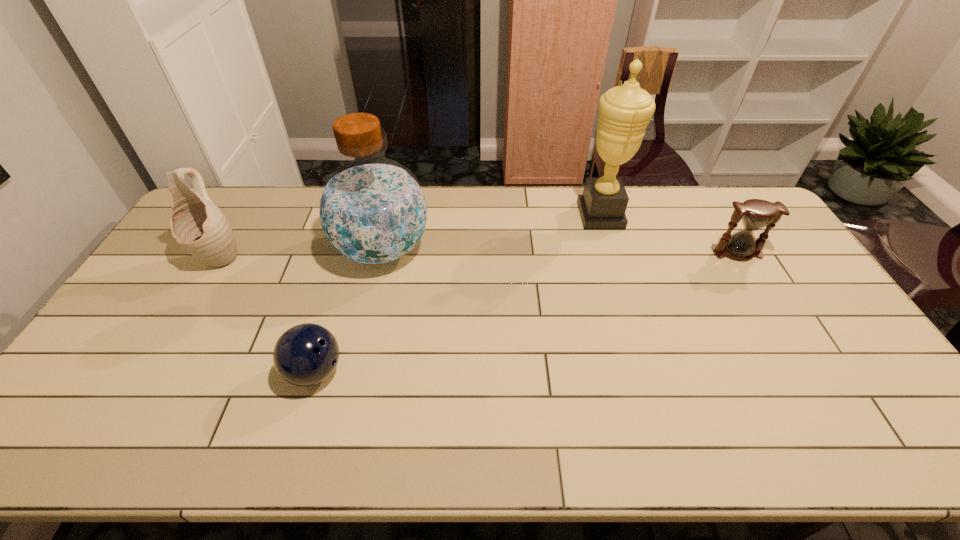
Image resolution: width=960 pixels, height=540 pixels. I want to click on trophy cup, so click(625, 111).

Locate an element on the screen. The width and height of the screenshot is (960, 540). the fourth object from left to right is located at coordinates (625, 111).

This screenshot has height=540, width=960. Find the location of `water jug`. water jug is located at coordinates (372, 211).

Where is `the leftmost object`? the leftmost object is located at coordinates (197, 224).

Identify the location of the third tallest object. (197, 224).

The width and height of the screenshot is (960, 540). What are the coordinates of `the rightmost object` in the screenshot? It's located at (755, 214).

Identify the location of hourglass. This screenshot has height=540, width=960. (755, 214).

Find the location of a particular element. bowling ball is located at coordinates (306, 354).

Locate an element on the screen. The height and width of the screenshot is (540, 960). the shortest object is located at coordinates (306, 354).

I want to click on vacant space located at the front of the tallest object with handles, so pyautogui.click(x=511, y=215).